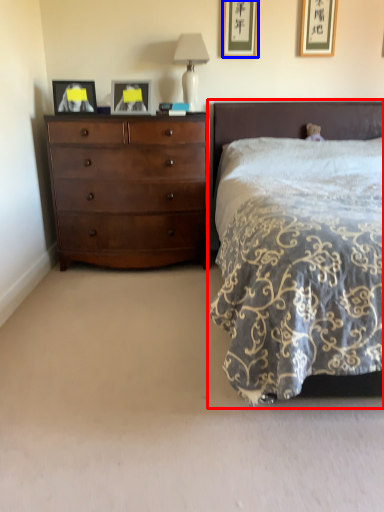
Question: Which point is further to the camera, bed (highlighted by a red box) or picture frame (highlighted by a blue box)?

Choices:
 (A) bed
 (B) picture frame

Answer: (B)